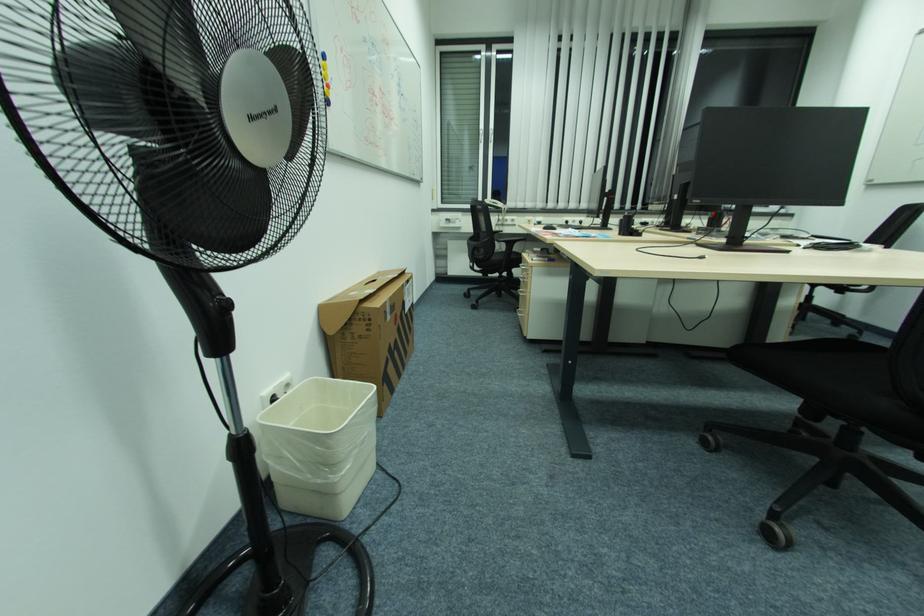
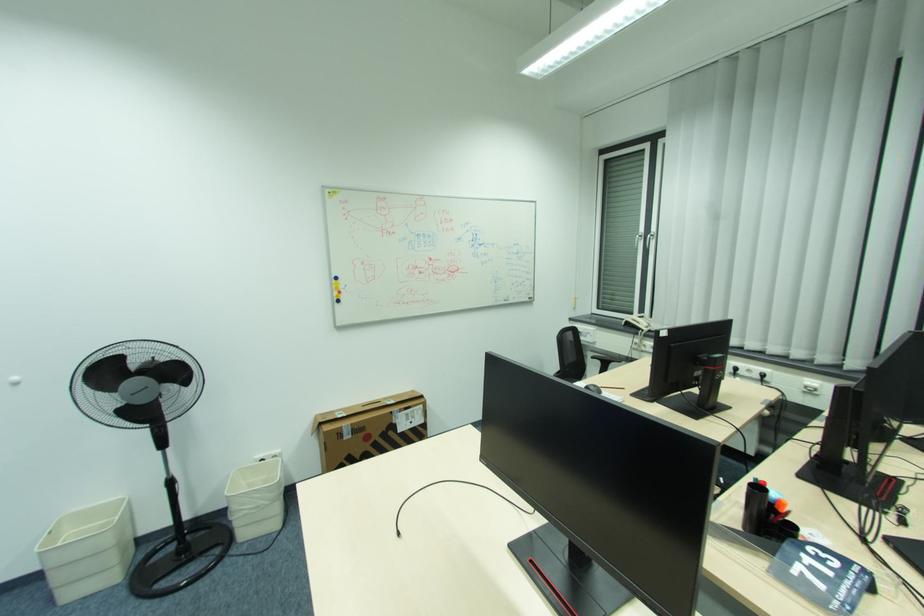
Where in the second image is the point corresponding to pixel 391 302 from the first image?

(346, 427)